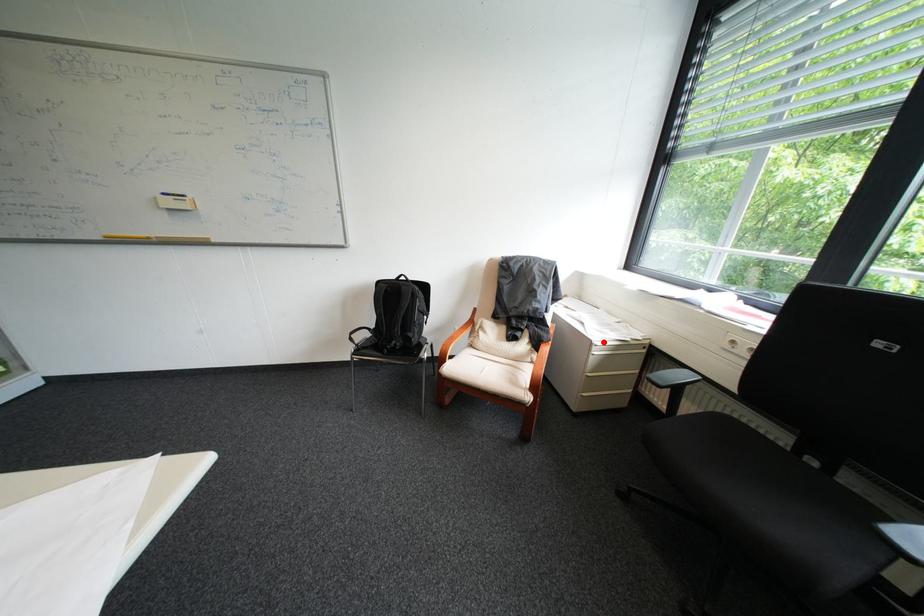
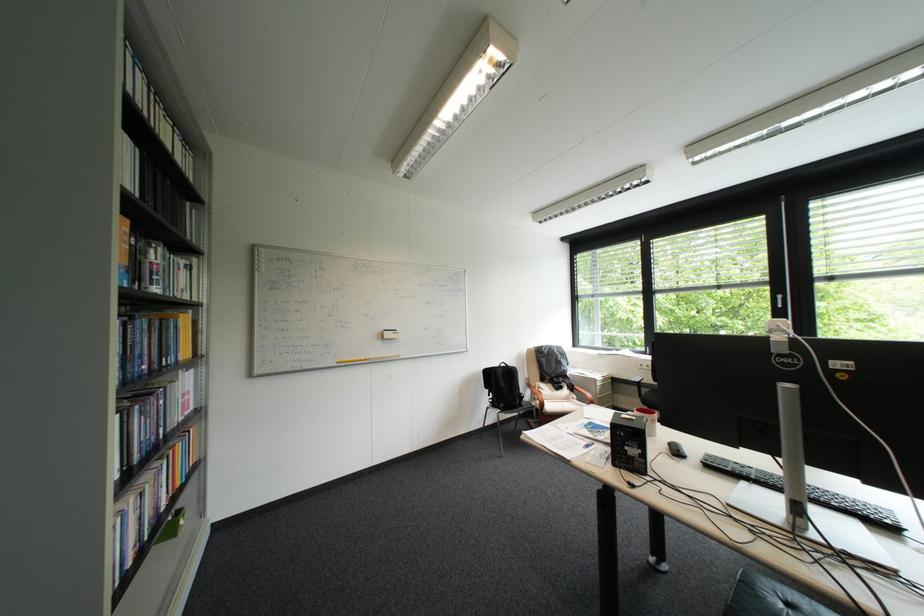
Find the pixel in the second image that matches the highlighted location in the first image.

(608, 379)